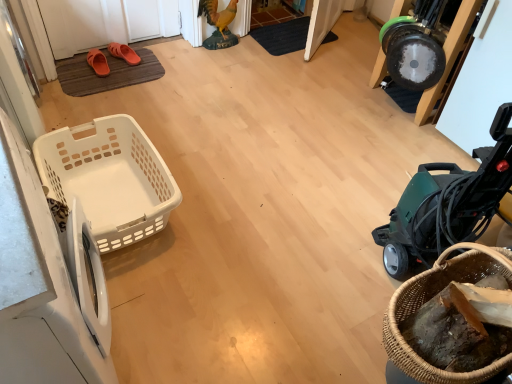
Where is `vacant space underneath brown rubber doormat at upper left, which is the first doormat from left to right (from a real-world perspective)`? This screenshot has height=384, width=512. vacant space underneath brown rubber doormat at upper left, which is the first doormat from left to right (from a real-world perspective) is located at coordinates (97, 76).